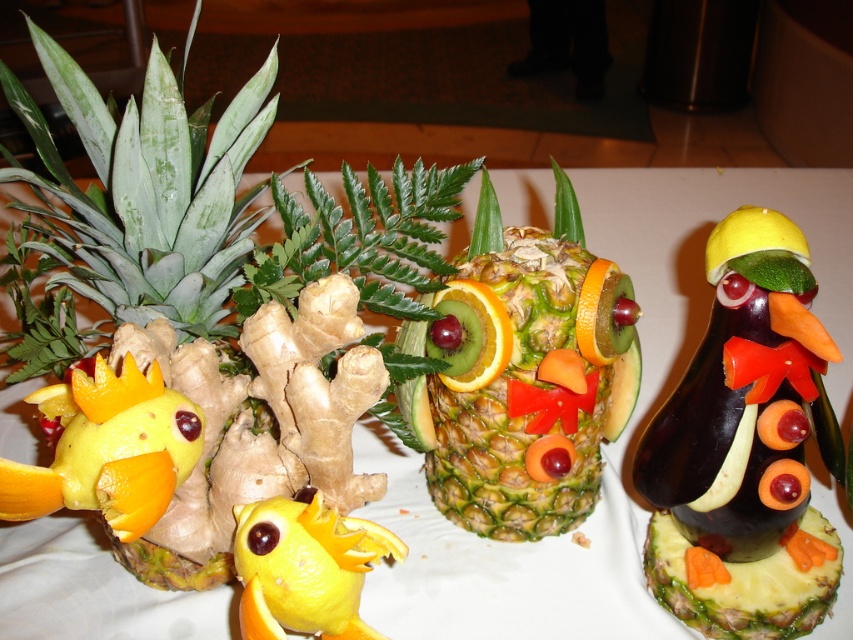
Between green textured pineapple at center and yellow peel at center, which one has less height?

yellow peel at center

Does green textured pineapple at center lie in front of yellow peel at center?

That is False.

Between point (570, 426) and point (285, 541), which one is positioned in front?

Point (285, 541)

Where is `green textured pineapple at center`? green textured pineapple at center is located at coordinates (529, 374).

How distant is yellow matte pineapple at lower left from yellow peel at center?

yellow matte pineapple at lower left and yellow peel at center are 7.08 inches apart from each other.

Can you confirm if yellow matte pineapple at lower left is bigger than yellow peel at center?

Indeed, yellow matte pineapple at lower left has a larger size compared to yellow peel at center.

Is point (239, 284) closer to camera compared to point (334, 529)?

No, (239, 284) is further to viewer.

The image size is (853, 640). Find the location of `yellow matte pineapple at lower left`. yellow matte pineapple at lower left is located at coordinates (148, 193).

Can you confirm if yellow matte pineapple at lower left is positioned to the right of yellow orange peel at center left?

No, yellow matte pineapple at lower left is not to the right of yellow orange peel at center left.

Is yellow matte pineapple at lower left wider than yellow orange peel at center left?

Correct, the width of yellow matte pineapple at lower left exceeds that of yellow orange peel at center left.

What do you see at coordinates (148, 193) in the screenshot? This screenshot has width=853, height=640. I see `yellow matte pineapple at lower left` at bounding box center [148, 193].

The width and height of the screenshot is (853, 640). Identify the location of yellow matte pineapple at lower left. (148, 193).